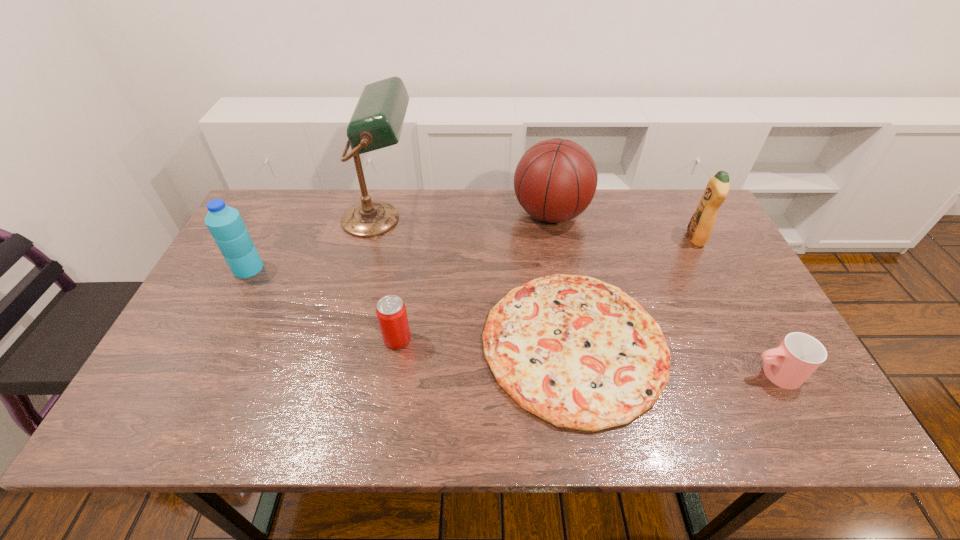
Image resolution: width=960 pixels, height=540 pixels. Find the location of `vacant position in the image that satisfies the following two spatial constraints: 1. on the side of the cup with the handle; 2. on the label of the detergent`. vacant position in the image that satisfies the following two spatial constraints: 1. on the side of the cup with the handle; 2. on the label of the detergent is located at coordinates (702, 238).

Locate an element on the screen. vacant area that satisfies the following two spatial constraints: 1. on the front side of the basketball; 2. on the side of the second shortest object with the handle is located at coordinates (579, 374).

Locate an element on the screen. free space that satisfies the following two spatial constraints: 1. on the front side of the third shortest object; 2. on the right side of the pizza is located at coordinates (396, 345).

The image size is (960, 540). I want to click on free spot that satisfies the following two spatial constraints: 1. above the green lampshade of the table lamp; 2. on the back side of the fifth tallest object, so click(x=349, y=339).

In order to click on vacant position in the image that satisfies the following two spatial constraints: 1. on the side of the second shortest object with the handle; 2. on the front side of the basketball in this screenshot , I will do `click(689, 214)`.

This screenshot has width=960, height=540. I want to click on free space that satisfies the following two spatial constraints: 1. on the front side of the leftmost object; 2. on the side of the sixth tallest object with the handle, so click(193, 374).

Where is `vacant point that satisfies the following two spatial constraints: 1. on the label of the detergent; 2. on the side of the cup with the handle`? The height and width of the screenshot is (540, 960). vacant point that satisfies the following two spatial constraints: 1. on the label of the detergent; 2. on the side of the cup with the handle is located at coordinates (765, 374).